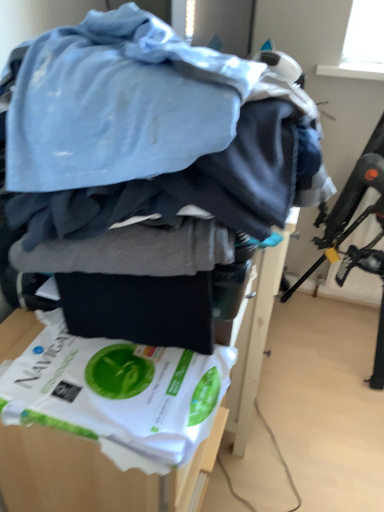
Locate an element on the screen. The width and height of the screenshot is (384, 512). free region under black plastic swivel chair at upper right (from a real-world perspective) is located at coordinates (324, 334).